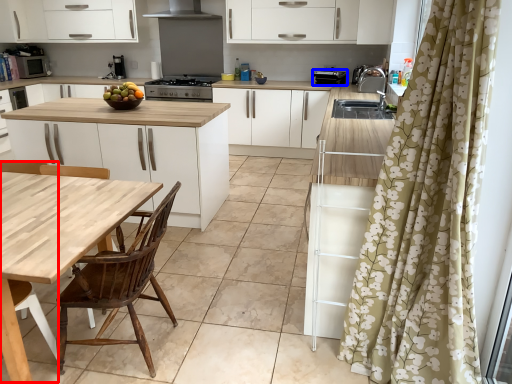
Question: Which point is closer to the camera, chair (highlighted by a red box) or appliance (highlighted by a blue box)?

Choices:
 (A) chair
 (B) appliance

Answer: (A)